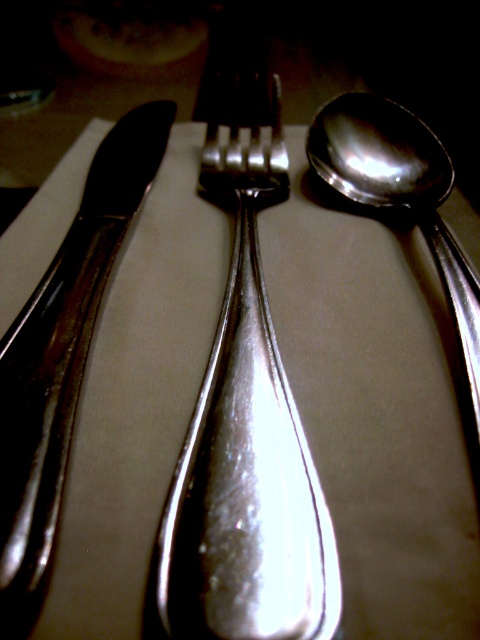
Question: Can you confirm if polished silver fork at center is smaller than polished silver spoon at right?

Choices:
 (A) no
 (B) yes

Answer: (A)

Question: Is polished silver fork at center behind polished silver spoon at right?

Choices:
 (A) no
 (B) yes

Answer: (A)

Question: Which point is farther from the camera taking this photo?

Choices:
 (A) (444, 172)
 (B) (94, 285)

Answer: (A)

Question: Which object is farther from the camera taking this photo?

Choices:
 (A) polished silver fork at center
 (B) polished silver spoon at right
 (C) polished silver knife at left

Answer: (B)

Question: Is polished silver knife at left behind polished silver spoon at right?

Choices:
 (A) no
 (B) yes

Answer: (A)

Question: Considering the real-world distances, which object is closest to the polished silver spoon at right?

Choices:
 (A) polished silver knife at left
 (B) polished silver fork at center

Answer: (B)